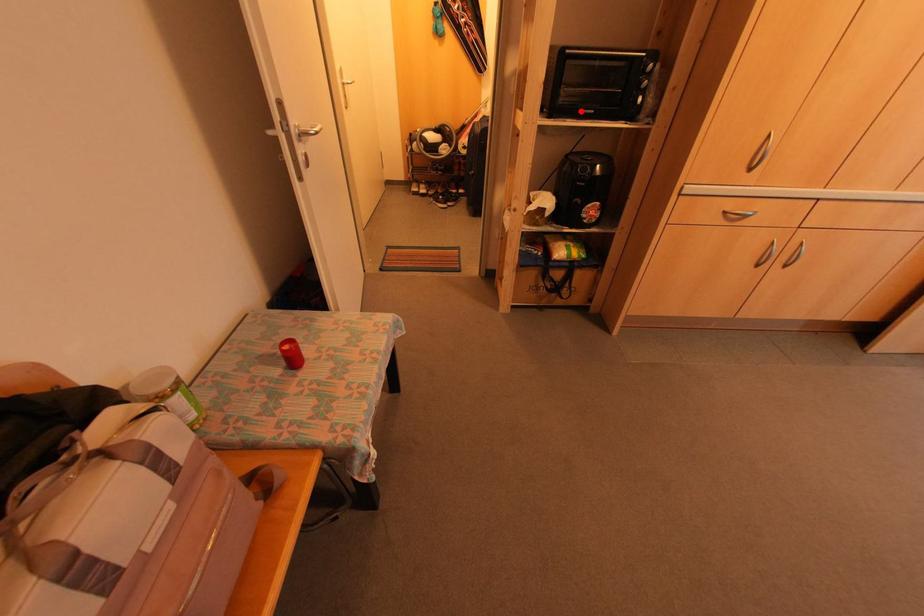
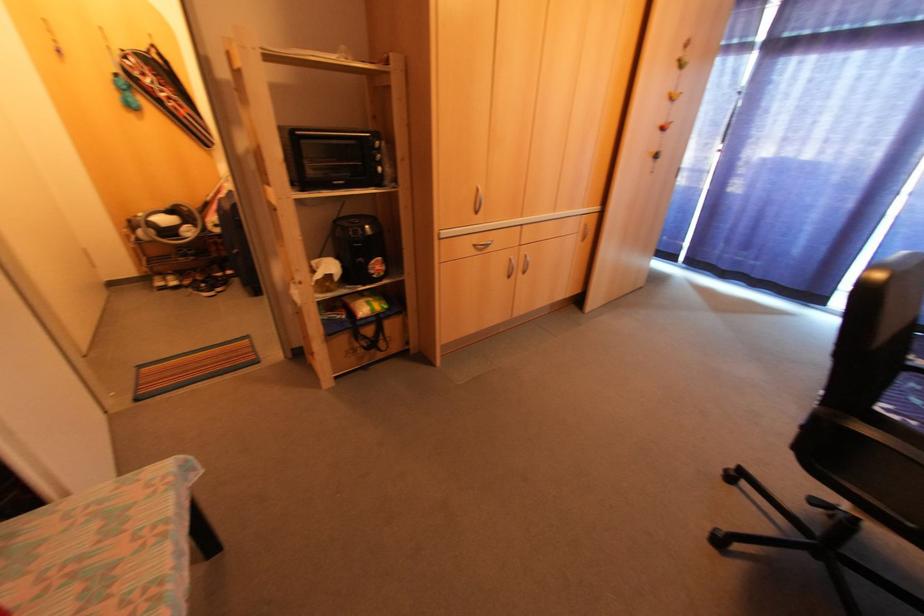
Question: A red point is marked in image1. In image2, is the corresponding 3D point closer to the camera or farther? Reply with the corresponding letter.

Choices:
 (A) The corresponding 3D point is closer.
 (B) The corresponding 3D point is farther.

Answer: (A)